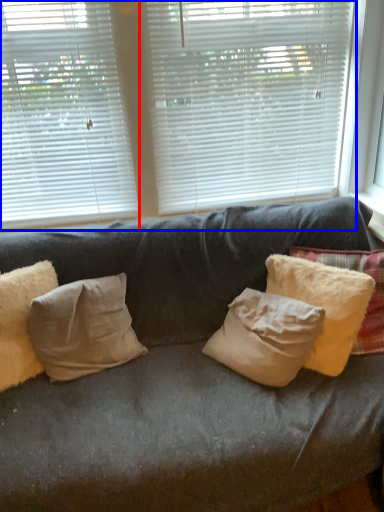
Question: Which point is further to the camera, window blind (highlighted by a red box) or window blind (highlighted by a blue box)?

Choices:
 (A) window blind
 (B) window blind

Answer: (B)